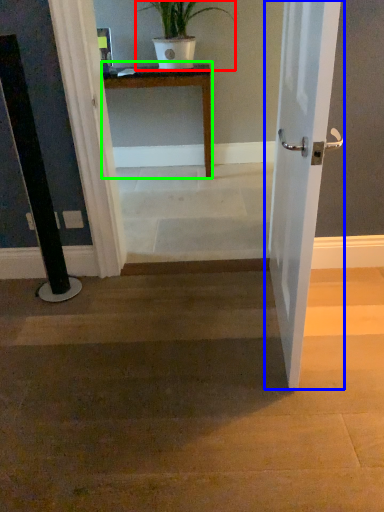
Question: Estimate the real-world distances between objects in this image. Which object is closer to houseplant (highlighted by a red box), door (highlighted by a blue box) or table (highlighted by a green box)?

Choices:
 (A) door
 (B) table

Answer: (B)